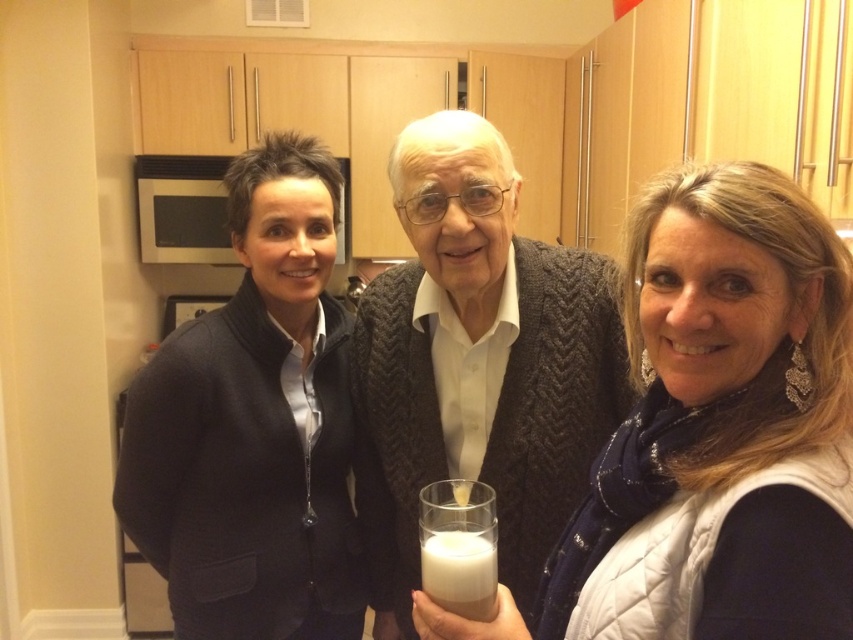
Question: Which object appears farthest from the camera in this image?

Choices:
 (A) white matte glass at center
 (B) white frothy liquid at center

Answer: (B)

Question: Is stainless steel microwave at left thinner than white frothy liquid at center?

Choices:
 (A) yes
 (B) no

Answer: (B)

Question: Considering the relative positions of stainless steel microwave at left and white frothy liquid at center in the image provided, where is stainless steel microwave at left located with respect to white frothy liquid at center?

Choices:
 (A) left
 (B) right

Answer: (A)

Question: Observing the image, what is the correct spatial positioning of dark blue sweater at center in reference to stainless steel microwave at left?

Choices:
 (A) right
 (B) left

Answer: (A)

Question: Which point appears closest to the camera in this image?

Choices:
 (A) (242, 625)
 (B) (456, 342)
 (C) (703, 470)
 (D) (496, 529)

Answer: (C)

Question: Among these points, which one is farthest from the camera?

Choices:
 (A) (514, 554)
 (B) (482, 557)
 (C) (454, 122)
 (D) (137, 401)

Answer: (D)